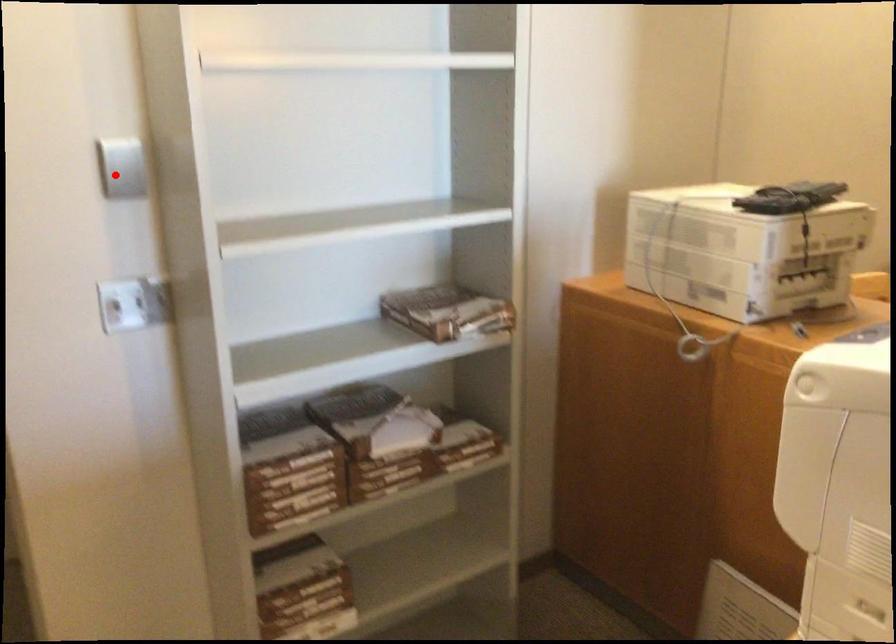
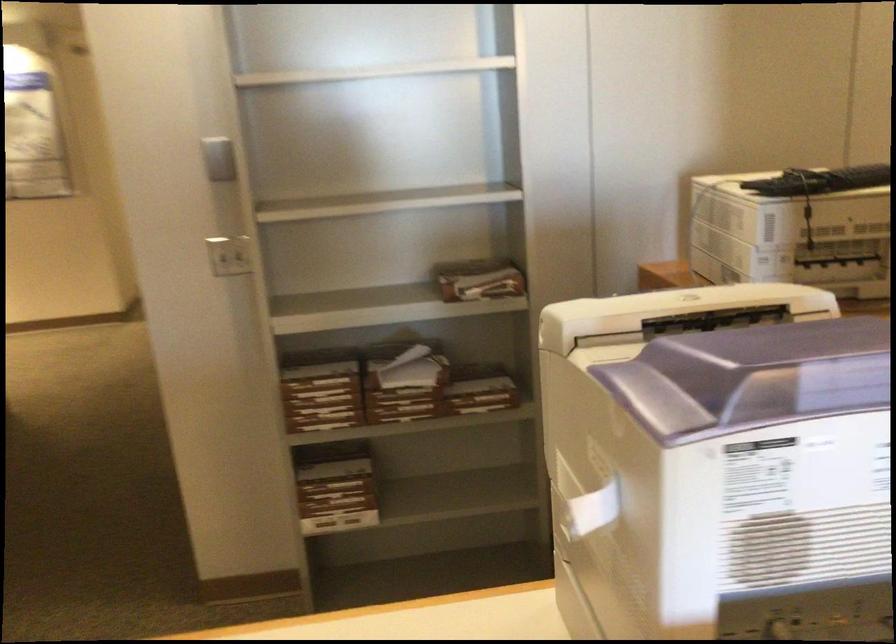
Question: I am providing you with two images of the same scene from different viewpoints. Given a red point in image1, look at the same physical point in image2. Is it:

Choices:
 (A) Closer to the viewpoint
 (B) Farther from the viewpoint

Answer: (B)